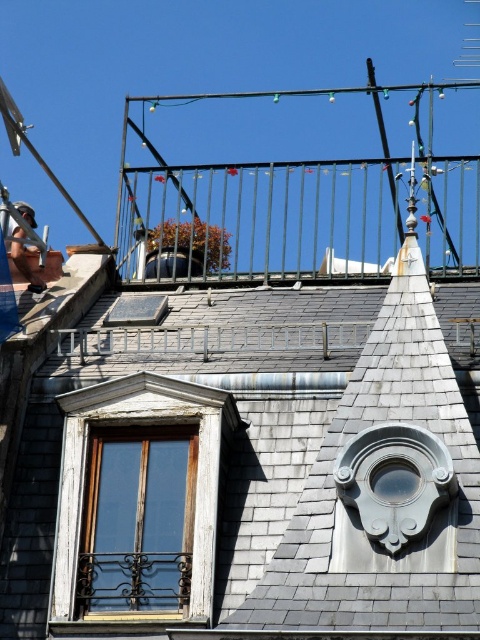
Can you confirm if wooden window at center is bigger than metallic black balcony at upper center?

Actually, wooden window at center might be smaller than metallic black balcony at upper center.

Between wooden window at center and metallic black balcony at upper center, which one has less height?

Standing shorter between the two is metallic black balcony at upper center.

Find the location of a particular element. Image resolution: width=480 pixels, height=640 pixels. wooden window at center is located at coordinates (139, 504).

Does metallic black balcony at upper center lie behind wooden window at lower left?

Yes, it is.

What do you see at coordinates (267, 216) in the screenshot? I see `metallic black balcony at upper center` at bounding box center [267, 216].

Locate an element on the screen. Image resolution: width=480 pixels, height=640 pixels. metallic black balcony at upper center is located at coordinates (267, 216).

Can you confirm if wooden window at center is bigger than wooden window at lower left?

Yes, wooden window at center is bigger than wooden window at lower left.

Which is behind, point (166, 605) or point (164, 497)?

Point (164, 497)

The width and height of the screenshot is (480, 640). What do you see at coordinates (139, 504) in the screenshot?
I see `wooden window at center` at bounding box center [139, 504].

Where is `wooden window at center`? wooden window at center is located at coordinates (139, 504).